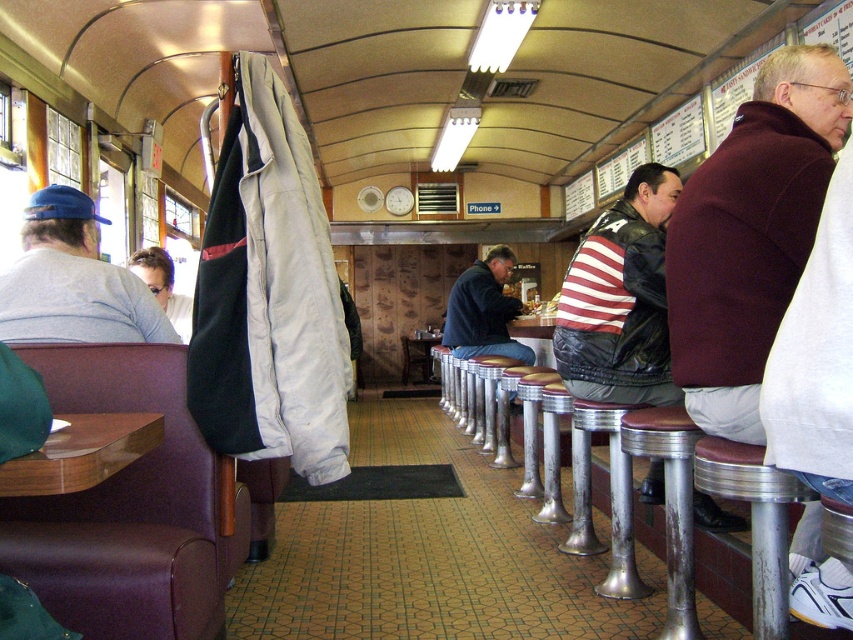
You are a diner employee who needs to retrieve the maroon woolen sweater at right and the striped leather jacket at center for a customer. Which item should you grab first to reach them in the correct order?

You should grab the maroon woolen sweater at right first because it is closer to you than the striped leather jacket at center, so you can reach it without needing to move further back.

You are a customer entering the diner and want to sit at both the point labeled as point (804,58) and point (640,176). Which seat would you reach first if you walk straight towards them from the entrance?

You would reach point (804,58) first because it is closer to the camera than point (640,176), meaning it is nearer to your starting position at the entrance.

You are a customer entering the diner and want to sit at both the point marked as point (96, 444) and point (485, 260). Which point is closer to the entrance of the diner?

Point (96, 444) is in front of point (485, 260), so it is closer to the entrance.